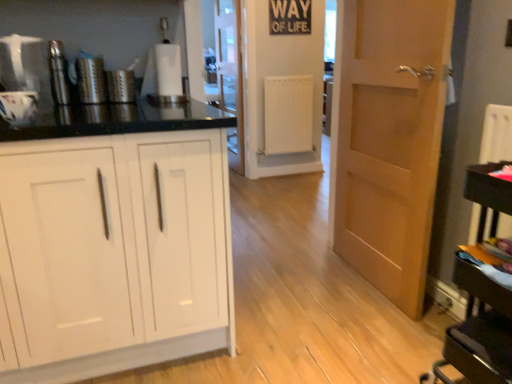
Question: Based on their positions, is metallic silver thermos at left, the third appliance positioned from the back, located to the left or right of clear glass screen door at center?

Choices:
 (A) left
 (B) right

Answer: (A)

Question: Looking at their shapes, would you say metallic silver thermos at left, the third appliance positioned from the back, is wider or thinner than clear glass screen door at center?

Choices:
 (A) thin
 (B) wide

Answer: (A)

Question: Which is nearer to the metallic grater at left, arranged as the fourth appliance when viewed from the front?

Choices:
 (A) white matte cabinet at left
 (B) white glossy mug at upper left, the 4th appliance in the back-to-front sequence
 (C) brushed metal grater at left, arranged as the third appliance when viewed from the front
 (D) clear glass screen door at center
 (E) white matte radiator at center

Answer: (C)

Question: Which object is positioned farthest from the white glossy mug at upper left, the first appliance from the front?

Choices:
 (A) metallic grater at left, marked as the 1th appliance in a back-to-front arrangement
 (B) white matte radiator at center
 (C) metallic silver thermos at left, which appears as the second appliance when viewed from the front
 (D) clear glass screen door at center
 (E) white matte cabinet at left

Answer: (D)